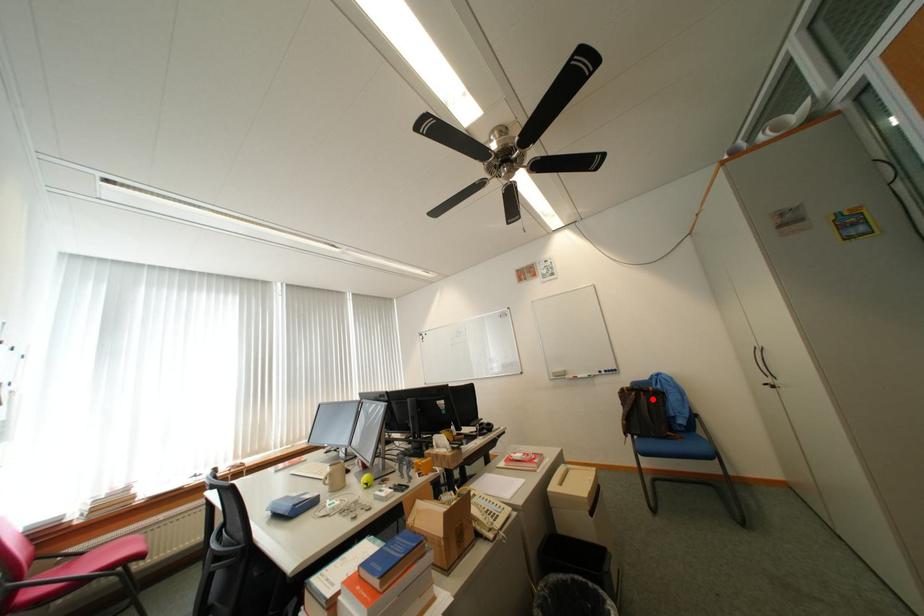
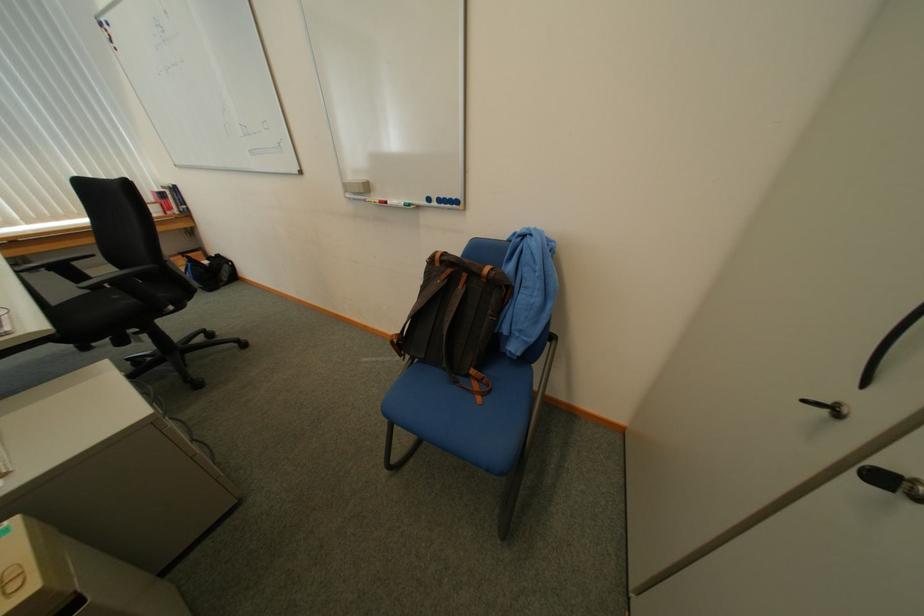
In the second image, find the point that corresponds to the highlighted location in the first image.

(469, 290)